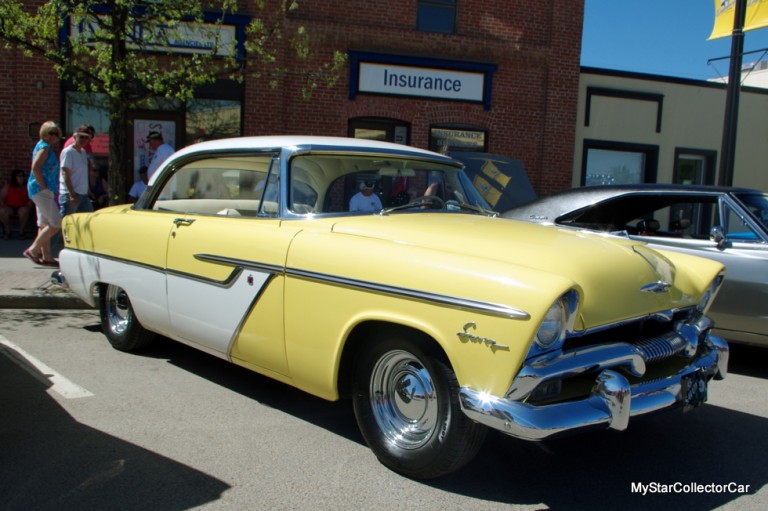
Locate an element on the screen. Image resolution: width=768 pixels, height=511 pixels. windows is located at coordinates (224, 177), (358, 174), (735, 229), (757, 210).